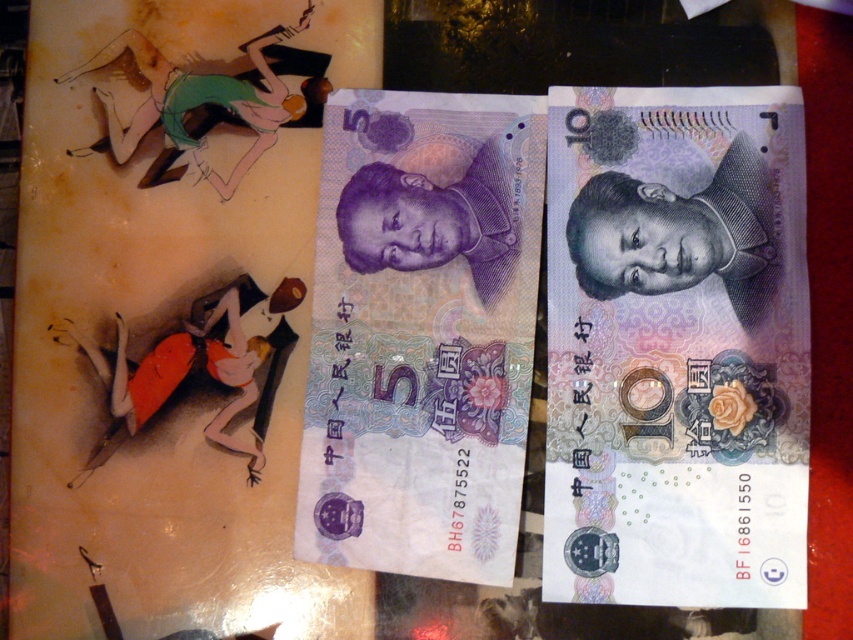
You are organizing a collection of Chinese banknotes and notice two notes on your desk. You have the matte purple banknote at center and the purple paper money at center. Which one is positioned to the right?

The matte purple banknote at center is to the right of the purple paper money at center.

You are a cashier who needs to distinguish between two banknotes. You have a matte purple banknote at center and a purple paper money at center in front of you. Based on their physical dimensions, which one is more likely to be the 5 Yuan note?

The matte purple banknote at center is thinner than purple paper money at center. Since the 5 Yuan note is typically thinner than the 10 Yuan note, the matte purple banknote at center is more likely to be the 5 Yuan note.